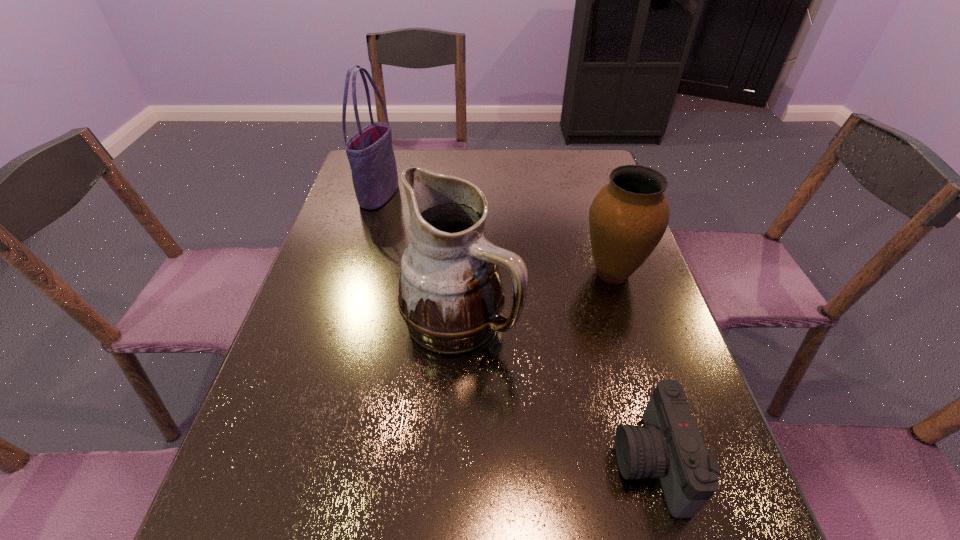
The height and width of the screenshot is (540, 960). I want to click on free space located 0.370m at the lens of the shortest object, so click(408, 462).

Locate an element on the screen. Image resolution: width=960 pixels, height=540 pixels. free space located at the lens of the shortest object is located at coordinates (396, 462).

The height and width of the screenshot is (540, 960). What are the coordinates of `object that is at the far edge` in the screenshot? It's located at (370, 152).

At what (x,y) coordinates should I click in order to perform the action: click on object at the left edge. Please return your answer as a coordinate pair (x, y). This screenshot has height=540, width=960. Looking at the image, I should click on (370, 152).

I want to click on urn that is positioned at the right edge, so click(x=628, y=217).

Where is `camera positioned at the right edge`? camera positioned at the right edge is located at coordinates (669, 446).

At what (x,y) coordinates should I click in order to perform the action: click on object positioned at the far left corner. Please return your answer as a coordinate pair (x, y). The width and height of the screenshot is (960, 540). Looking at the image, I should click on (370, 152).

Where is `free space at the far edge of the desktop`? Image resolution: width=960 pixels, height=540 pixels. free space at the far edge of the desktop is located at coordinates (484, 168).

I want to click on vacant space at the left edge of the desktop, so pyautogui.click(x=363, y=250).

In the image, there is a desktop. What are the coordinates of `blank space at the right edge` in the screenshot? It's located at (632, 414).